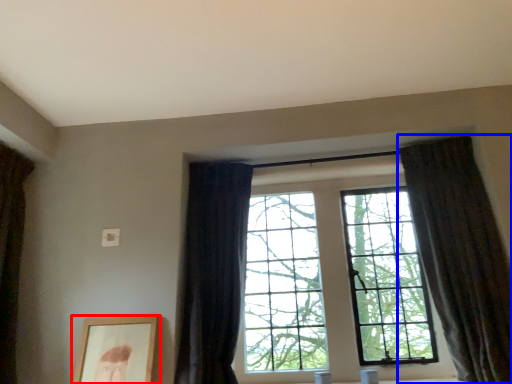
Question: Which of the following is the farthest to the observer, picture frame (highlighted by a red box) or curtain (highlighted by a blue box)?

Choices:
 (A) picture frame
 (B) curtain

Answer: (A)